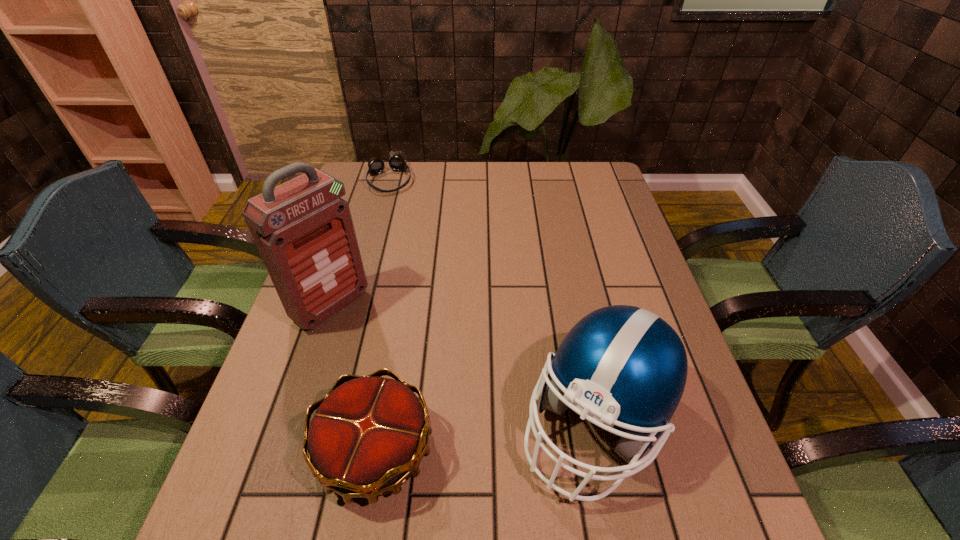
Identify the location of vacant space on the desktop that is between the second shortest object and the rightmost object and is positioned through the lenses of the shortest object. coord(465,439).

Where is `vacant space on the desktop that is between the crown and the third shortest object and is positioned on the front-facing side of the second farthest object`? vacant space on the desktop that is between the crown and the third shortest object and is positioned on the front-facing side of the second farthest object is located at coordinates (494, 435).